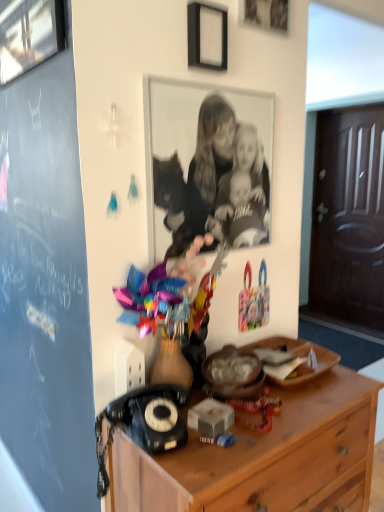
Locate an element on the screen. This screenshot has height=512, width=384. vacant area that lies in front of wooden plate at center is located at coordinates (300, 406).